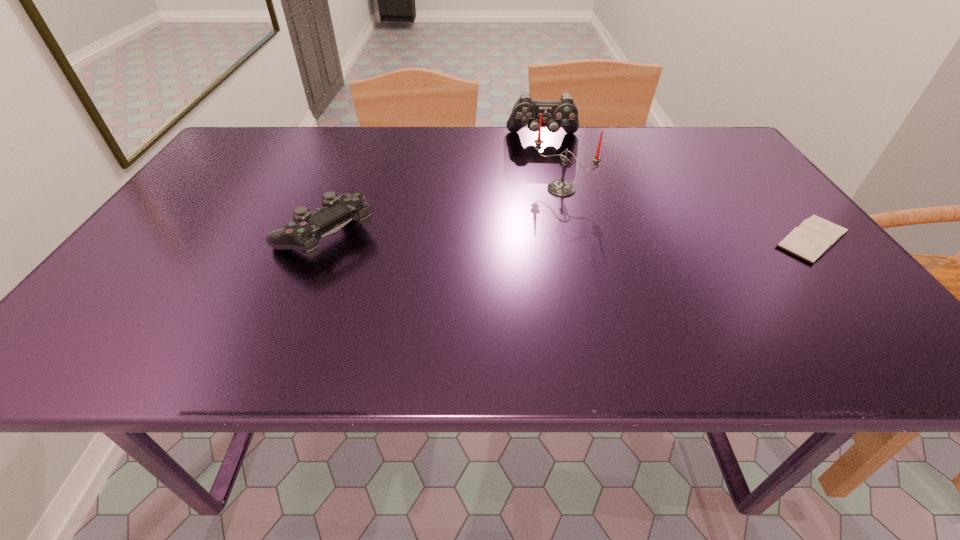
Where is `free space at the left edge`? The width and height of the screenshot is (960, 540). free space at the left edge is located at coordinates (167, 230).

The width and height of the screenshot is (960, 540). Identify the location of vacant region at the right edge of the desktop. (778, 227).

In the image, there is a desktop. Where is `free space at the far left corner`? The height and width of the screenshot is (540, 960). free space at the far left corner is located at coordinates (235, 151).

Identify the location of vacant space at the near right corner. The width and height of the screenshot is (960, 540). (853, 293).

Identify the location of blank region between the second farthest object and the left control. (443, 212).

You are a GUI agent. You are given a task and a screenshot of the screen. Output one action in this format:
    pyautogui.click(x=<x>, y=<y>)
    Task: Click on the unoccupied area between the second farthest object and the rightmost object
    This screenshot has width=960, height=540.
    Given the screenshot: What is the action you would take?
    pyautogui.click(x=686, y=214)

The image size is (960, 540). What are the coordinates of `empty location between the candle and the nearer control` in the screenshot? It's located at click(443, 212).

At what (x,y) coordinates should I click in order to perform the action: click on vacant area that lies between the second farthest object and the shortest object. Please return your answer as a coordinate pair (x, y). The width and height of the screenshot is (960, 540). Looking at the image, I should click on (686, 214).

Where is `vacant region between the third nearest object and the diary`? The width and height of the screenshot is (960, 540). vacant region between the third nearest object and the diary is located at coordinates (686, 214).

Locate an element on the screen. free space between the second farthest object and the rightmost object is located at coordinates (686, 214).